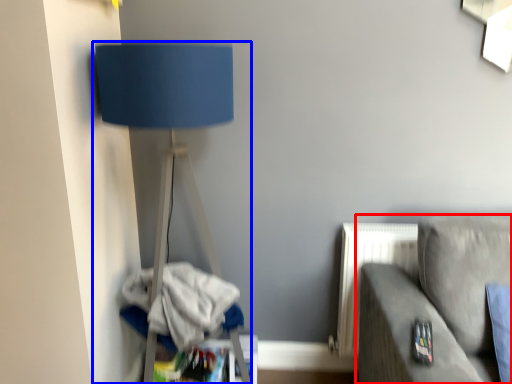
Question: Among these objects, which one is farthest to the camera, studio couch (highlighted by a red box) or lamp (highlighted by a blue box)?

Choices:
 (A) studio couch
 (B) lamp

Answer: (B)